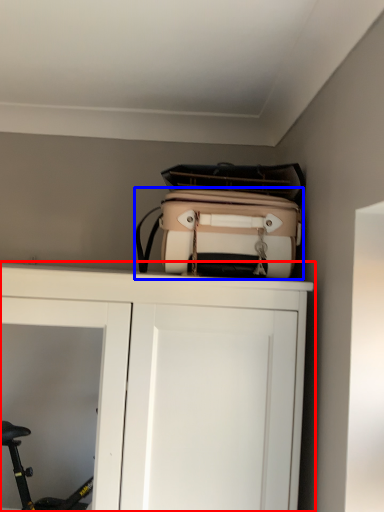
Question: Which object appears closest to the camera in this image, cupboard (highlighted by a red box) or luggage and bags (highlighted by a blue box)?

Choices:
 (A) cupboard
 (B) luggage and bags

Answer: (A)